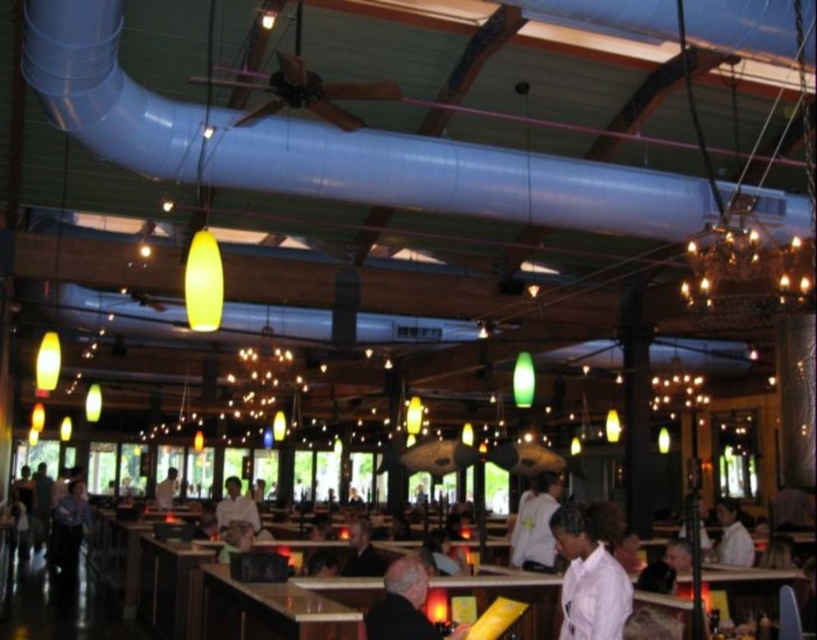
Between dark gray sweater at center and white shirt at center, which one appears on the left side from the viewer's perspective?

Positioned to the left is white shirt at center.

Who is higher up, dark gray sweater at center or white shirt at center?

dark gray sweater at center is above.

Is point (365, 637) positioned behind point (257, 520)?

No, (365, 637) is closer to viewer.

Where is `dark gray sweater at center`? The width and height of the screenshot is (817, 640). dark gray sweater at center is located at coordinates (404, 605).

Identify the location of dark gray sweater at center. The image size is (817, 640). (404, 605).

Who is positioned more to the right, dark gray sweater at center or dark brown leather jacket at center?

dark gray sweater at center

Does point (367, 611) come closer to viewer compared to point (369, 552)?

Yes.

You are a GUI agent. You are given a task and a screenshot of the screen. Output one action in this format:
    pyautogui.click(x=<x>, y=<y>)
    Task: Click on the dark gray sweater at center
    
    Given the screenshot: What is the action you would take?
    pyautogui.click(x=404, y=605)

Is blue metallic pipe at upper center taller than white matte uniform at center?

No, blue metallic pipe at upper center is not taller than white matte uniform at center.

Can you confirm if blue metallic pipe at upper center is positioned below white matte uniform at center?

Incorrect, blue metallic pipe at upper center is not positioned below white matte uniform at center.

Locate an element on the screen. blue metallic pipe at upper center is located at coordinates (328, 147).

This screenshot has width=817, height=640. Identify the location of blue metallic pipe at upper center. (328, 147).